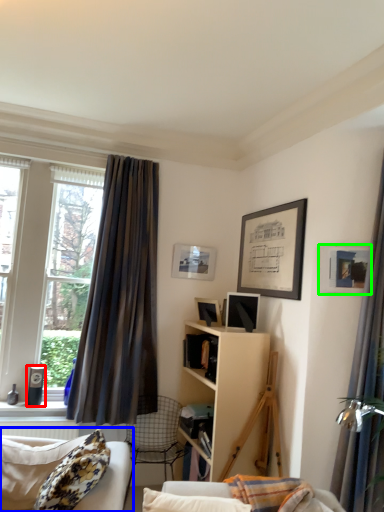
Question: Considering the real-world distances, which object is closest to speaker (highlighted by a red box)? studio couch (highlighted by a blue box) or picture frame (highlighted by a green box).

Choices:
 (A) studio couch
 (B) picture frame

Answer: (A)